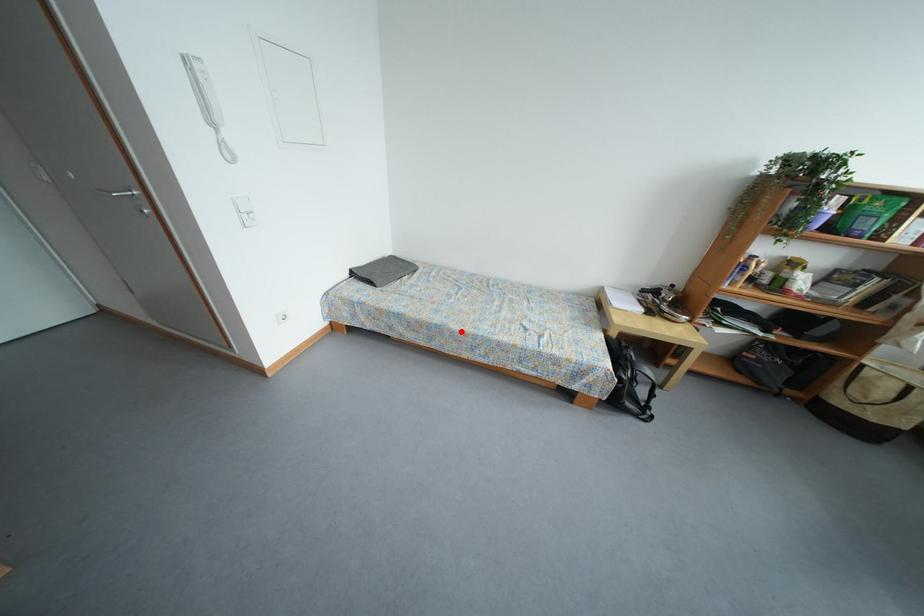
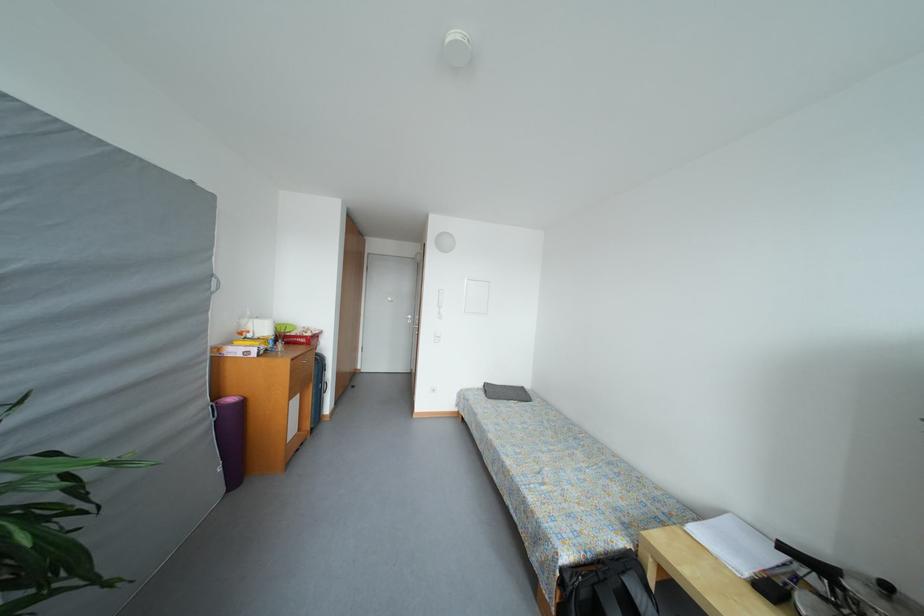
In the second image, find the point that corresponds to the highlighted location in the first image.

(496, 440)